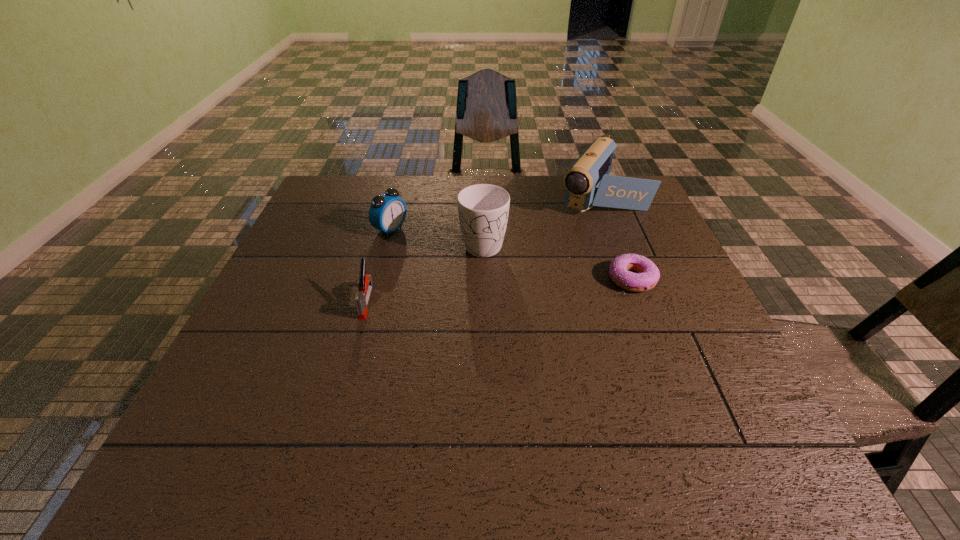
The height and width of the screenshot is (540, 960). In order to click on vacant region at the far edge in this screenshot , I will do click(387, 177).

Identify the location of free point at the near edge. The width and height of the screenshot is (960, 540). (345, 385).

Locate an element on the screen. This screenshot has height=540, width=960. vacant region at the left edge is located at coordinates (265, 285).

Where is `free region at the right edge of the desktop`? Image resolution: width=960 pixels, height=540 pixels. free region at the right edge of the desktop is located at coordinates (713, 351).

Identify the location of unoccupied area between the mug and the third shortest object. Image resolution: width=960 pixels, height=540 pixels. (437, 235).

At what (x,y) coordinates should I click in order to perform the action: click on empty space between the third object from right to left and the camcorder. Please return your answer as a coordinate pair (x, y). Looking at the image, I should click on (x=541, y=220).

You are a GUI agent. You are given a task and a screenshot of the screen. Output one action in this format:
    pyautogui.click(x=<x>, y=<y>)
    Task: Click on the free space between the shortest object and the second shortest object
    The width and height of the screenshot is (960, 540).
    Given the screenshot: What is the action you would take?
    [x=499, y=290]

Identify the location of vacant area that lies between the doughnut and the alarm clock. (511, 254).

Locate an element on the screen. The width and height of the screenshot is (960, 540). free space between the camcorder and the mug is located at coordinates (541, 220).

Identify which object is the fourth closest to the stapler. Please provide its 2D coordinates. Your answer should be formatted as a tuple, i.e. [(x, y)], where the tuple contains the x and y coordinates of a point satisfying the conditions above.

[(648, 274)]